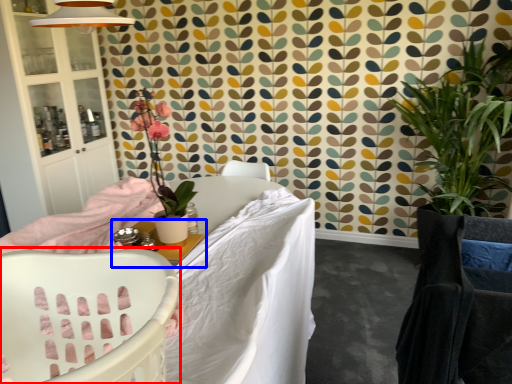
Question: Among these objects, which one is farthest to the camera, chair (highlighted by a red box) or table (highlighted by a blue box)?

Choices:
 (A) chair
 (B) table

Answer: (B)